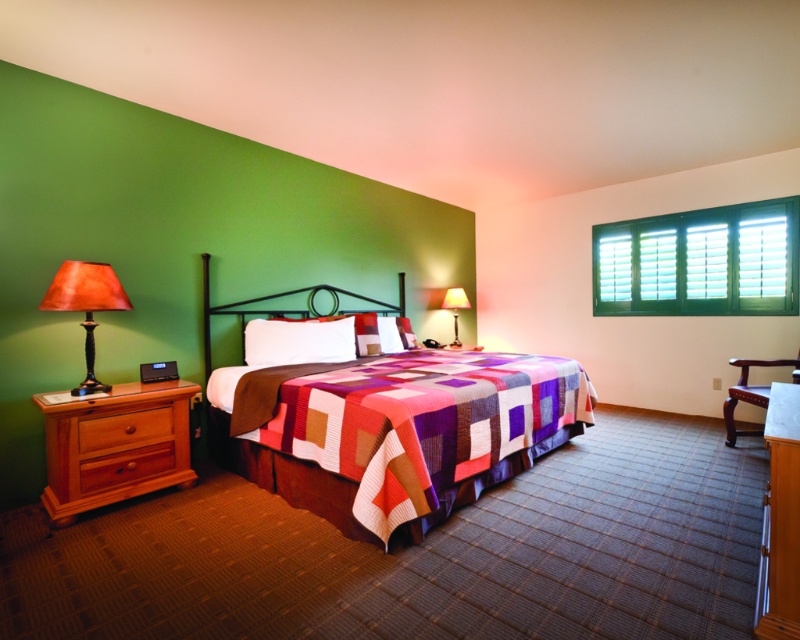
Question: Which object is closer to the camera taking this photo?

Choices:
 (A) cherry wood drawer at left
 (B) green wood window at upper right

Answer: (A)

Question: Considering the real-world distances, which object is closest to the brown wood dresser at left?

Choices:
 (A) brown wooden chair at lower right
 (B) matte brown lamp at left
 (C) metallic black headboard at center
 (D) matte orange lampshade at center

Answer: (B)

Question: Does green wood window at upper right have a lesser width compared to brown wood dresser at left?

Choices:
 (A) yes
 (B) no

Answer: (B)

Question: Estimate the real-world distances between objects in this image. Which object is farther from the wooden drawer at lower left?

Choices:
 (A) white glossy dresser at lower right
 (B) multicolored quilted bed at center

Answer: (A)

Question: Is brown wooden chair at lower right behind matte orange lampshade at center?

Choices:
 (A) no
 (B) yes

Answer: (A)

Question: Does brown wood dresser at left appear on the right side of matte orange lampshade at center?

Choices:
 (A) no
 (B) yes

Answer: (A)